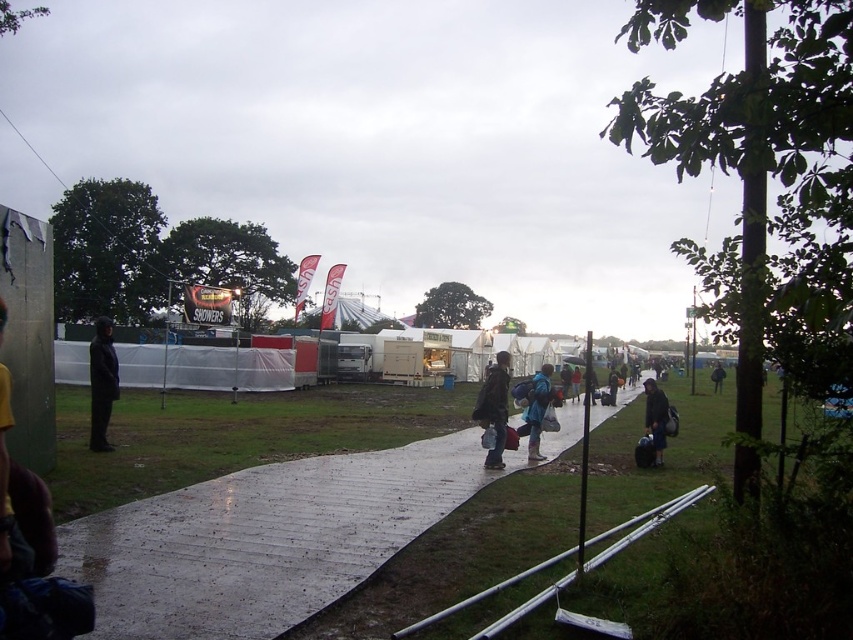
You are a visitor at the festival and want to reach the dark blue fabric bag at lower right from the wet plastic walkway at center. Which direction should you move relative to the walkway?

To reach the dark blue fabric bag at lower right from the wet plastic walkway at center, you should move to the right since the wet plastic walkway at center is positioned on the left side of the dark blue fabric bag at lower right.